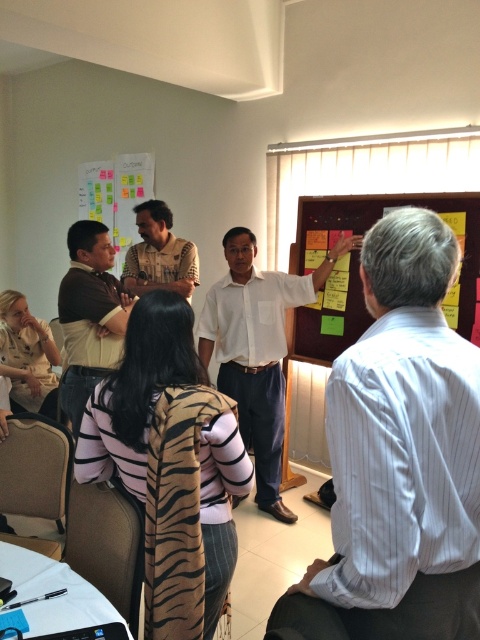
Question: Which of the following is the farthest from the observer?

Choices:
 (A) (368, 484)
 (B) (92, 264)

Answer: (B)

Question: Which object is positioned closest to the matte brown shirt at center?

Choices:
 (A) white shirt at center
 (B) brown leather jacket at center
 (C) white striped shirt at center
 (D) wooden bulletin board at center

Answer: (A)

Question: Does white striped shirt at center come in front of brown leather jacket at center?

Choices:
 (A) yes
 (B) no

Answer: (A)

Question: Is white shirt at center wider than brown leather jacket at center?

Choices:
 (A) yes
 (B) no

Answer: (A)

Question: Is brown leather jacket at center positioned before matte brown shirt at center?

Choices:
 (A) yes
 (B) no

Answer: (A)

Question: Which object is farther from the camera taking this photo?

Choices:
 (A) brown leather jacket at center
 (B) matte brown shirt at center
 (C) wooden bulletin board at center

Answer: (B)